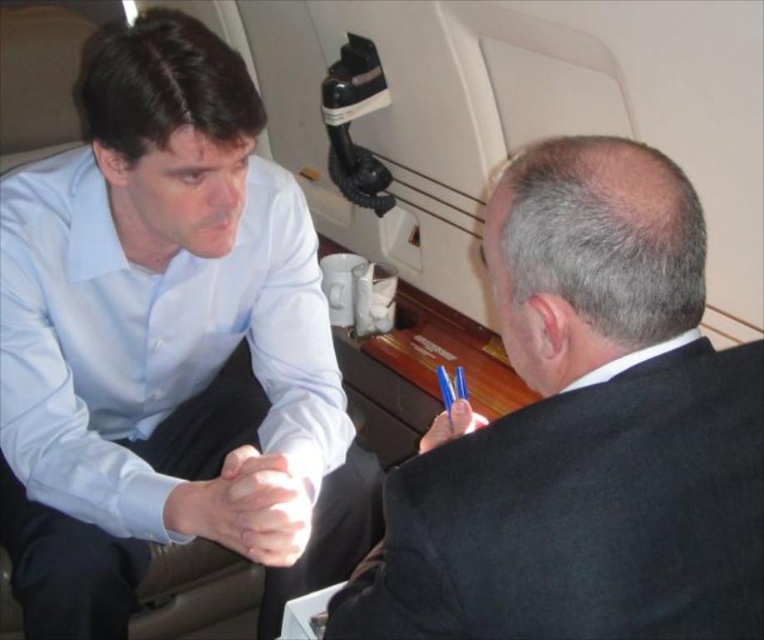
Based on the photo, can you confirm if light blue shirt at upper left is positioned to the right of black matte suit at right?

No, light blue shirt at upper left is not to the right of black matte suit at right.

Does light blue shirt at upper left appear under black matte suit at right?

No, light blue shirt at upper left is not below black matte suit at right.

Identify the location of light blue shirt at upper left. This screenshot has width=764, height=640. (167, 346).

Identify the location of light blue shirt at upper left. (167, 346).